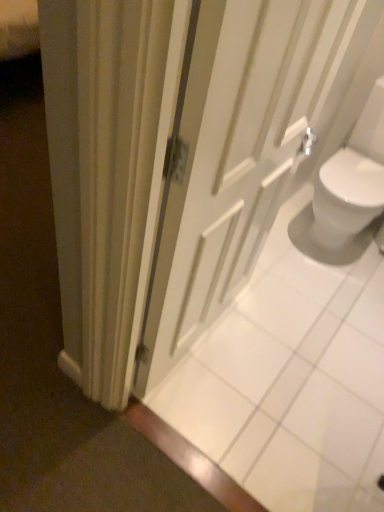
Question: From a real-world perspective, is white glossy sink at right positioned above or below white matte door at center?

Choices:
 (A) above
 (B) below

Answer: (B)

Question: From the image's perspective, is white glossy sink at right positioned above or below white matte door at center?

Choices:
 (A) above
 (B) below

Answer: (A)

Question: Relative to white matte door at center, is white glossy sink at right in front or behind?

Choices:
 (A) front
 (B) behind

Answer: (B)

Question: From a real-world perspective, is white matte door at center positioned above or below white glossy sink at right?

Choices:
 (A) above
 (B) below

Answer: (A)

Question: Is white matte door at center to the left or to the right of white glossy sink at right in the image?

Choices:
 (A) right
 (B) left

Answer: (B)

Question: Choose the correct answer: Is white matte door at center inside white glossy sink at right or outside it?

Choices:
 (A) inside
 (B) outside

Answer: (B)

Question: Looking at their shapes, would you say white matte door at center is wider or thinner than white glossy sink at right?

Choices:
 (A) wide
 (B) thin

Answer: (B)